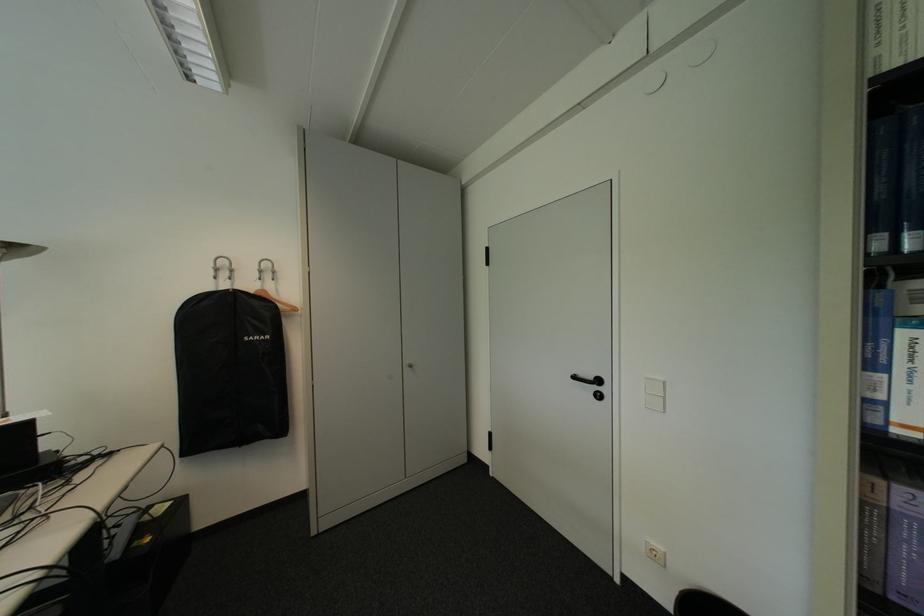
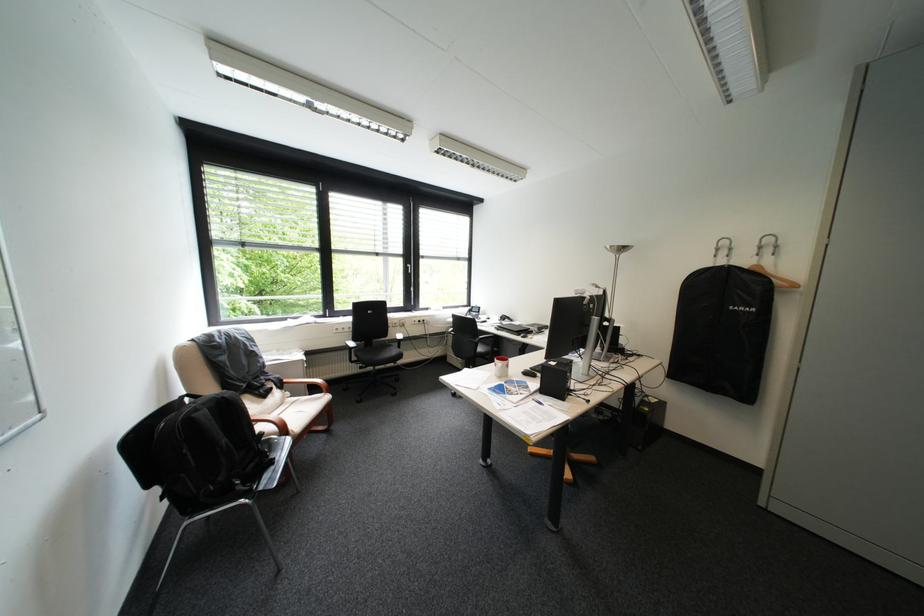
Where in the second image is the point corresponding to pixel 269 339 from the first image?

(755, 309)